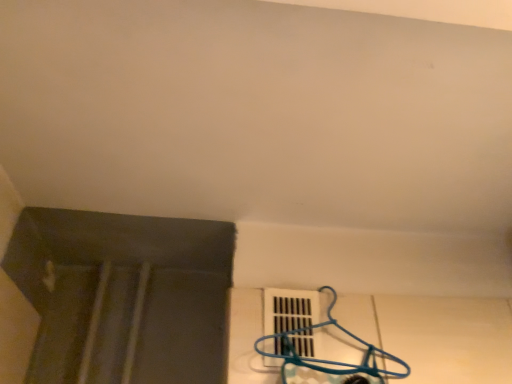
Question: In terms of width, does blue plastic hanger at lower right look wider or thinner when compared to white plastic vent at lower center?

Choices:
 (A) wide
 (B) thin

Answer: (A)

Question: Considering the positions of blue plastic hanger at lower right and white plastic vent at lower center in the image, is blue plastic hanger at lower right bigger or smaller than white plastic vent at lower center?

Choices:
 (A) big
 (B) small

Answer: (A)

Question: In terms of height, does blue plastic hanger at lower right look taller or shorter compared to white plastic vent at lower center?

Choices:
 (A) tall
 (B) short

Answer: (A)

Question: In terms of width, does white plastic vent at lower center look wider or thinner when compared to blue plastic hanger at lower right?

Choices:
 (A) wide
 (B) thin

Answer: (B)

Question: From their relative heights in the image, would you say white plastic vent at lower center is taller or shorter than blue plastic hanger at lower right?

Choices:
 (A) tall
 (B) short

Answer: (B)

Question: Looking at the image, does white plastic vent at lower center seem bigger or smaller compared to blue plastic hanger at lower right?

Choices:
 (A) small
 (B) big

Answer: (A)

Question: Does point (300, 334) appear closer or farther from the camera than point (345, 329)?

Choices:
 (A) closer
 (B) farther

Answer: (A)